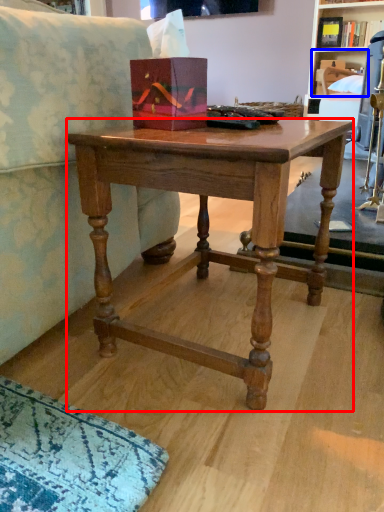
Question: Which point is closer to the camera, desk (highlighted by a red box) or shelf (highlighted by a blue box)?

Choices:
 (A) desk
 (B) shelf

Answer: (A)